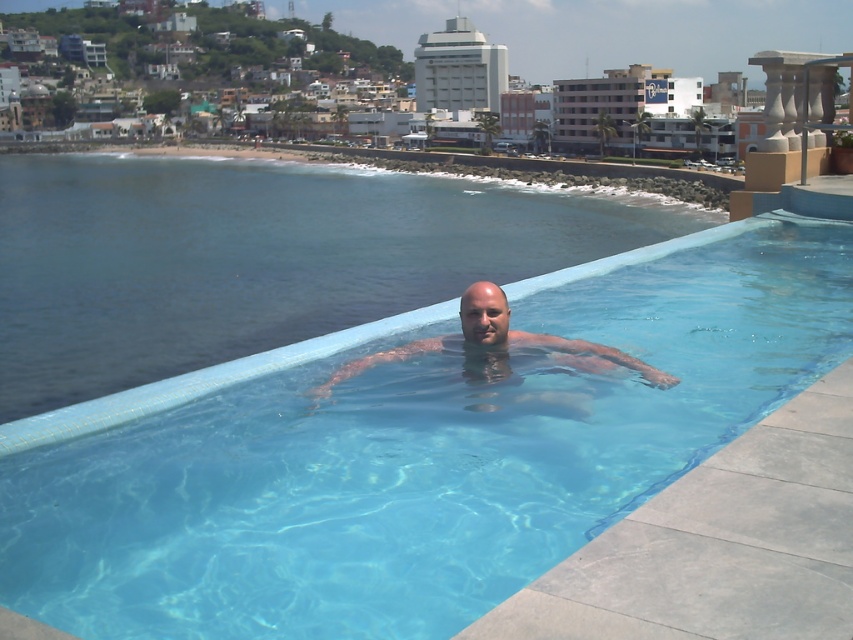
You are standing at the edge of the rooftop deck and want to jump into the clear blue water at center. Based on the distance provided, is this a safe jump? Please explain your reasoning.

The clear blue water at center is 43.94 feet away from the viewer. Jumping from such a height could be dangerous as 43.94 feet is equivalent to approximately 13.4 meters, which is significantly high for a safe jump into water. It is advisable to avoid jumping from this height to prevent injury.

You are designing a safety plan for the rooftop pool area. Considering the clear glass pool at center and the clear blue water at center, which one requires a guardrail to prevent accidental falls due to its width?

The clear blue water at center requires a guardrail because its width is greater than the clear glass pool at center, making it more prone to accidental falls.